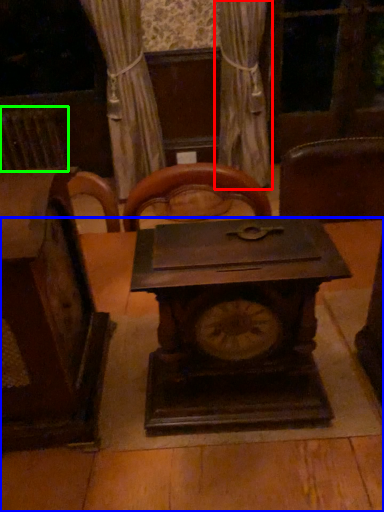
Question: Which is farther away from curtain (highlighted by a red box)? table (highlighted by a blue box) or radiator (highlighted by a green box)?

Choices:
 (A) table
 (B) radiator

Answer: (A)